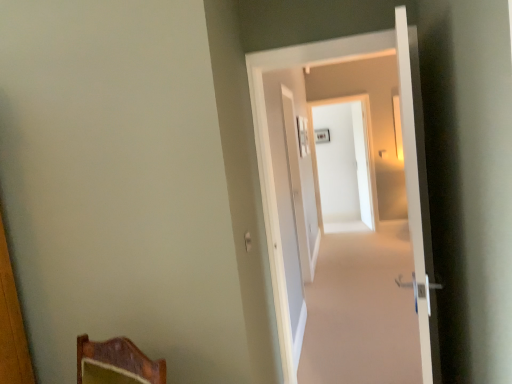
Question: From their relative heights in the image, would you say white glossy screen door at center, the 1th screen door when ordered from back to front, is taller or shorter than white glossy door at center, placed as the first door when sorted from back to front?

Choices:
 (A) short
 (B) tall

Answer: (B)

Question: Considering their positions, is white glossy screen door at center, the 1th screen door when ordered from back to front, located in front of or behind white glossy door at center, placed as the first door when sorted from back to front?

Choices:
 (A) behind
 (B) front

Answer: (A)

Question: Which of these objects is positioned closest to the white glossy door at center, placed as the first door when sorted from back to front?

Choices:
 (A) white glossy door at center, marked as the 1th screen door in a front-to-back arrangement
 (B) white glossy screen door at center, the 2th screen door viewed from the front
 (C) white glossy door at right, marked as the second door in a back-to-front arrangement

Answer: (C)

Question: Which object is positioned closest to the white glossy door at center, placed as the first door when sorted from back to front?

Choices:
 (A) white glossy door at right, marked as the second door in a back-to-front arrangement
 (B) white glossy screen door at center, acting as the second screen door starting from the left
 (C) white glossy door at center, positioned as the first screen door in left-to-right order

Answer: (A)